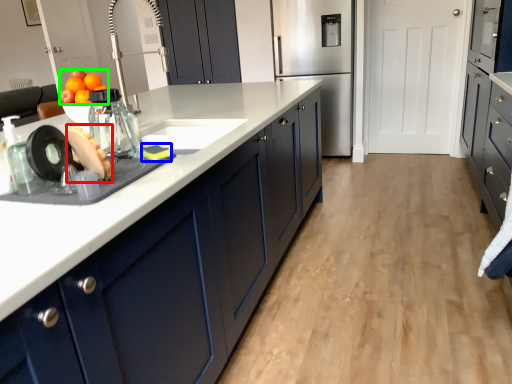
Question: Which is nearer to the food (highlighted by a red box)? food (highlighted by a blue box) or fruit (highlighted by a green box).

Choices:
 (A) food
 (B) fruit

Answer: (A)